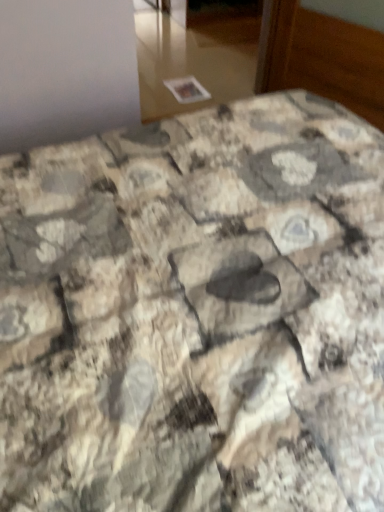
What do you see at coordinates (194, 60) in the screenshot?
I see `transparent glass door at upper center` at bounding box center [194, 60].

Identify the location of transparent glass door at upper center. This screenshot has width=384, height=512. (194, 60).

What is the approximate height of transparent glass door at upper center?

transparent glass door at upper center is 2.95 inches tall.

This screenshot has height=512, width=384. I want to click on transparent glass door at upper center, so click(194, 60).